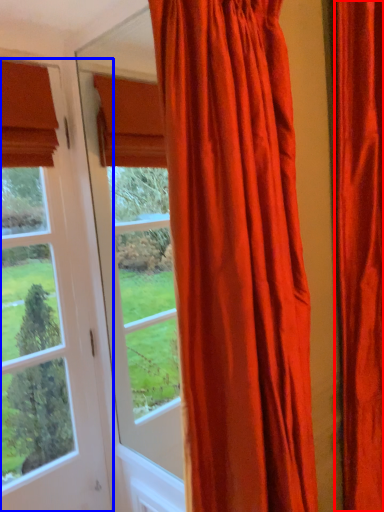
Question: Which object appears closest to the camera in this image, curtain (highlighted by a red box) or window (highlighted by a blue box)?

Choices:
 (A) curtain
 (B) window

Answer: (A)